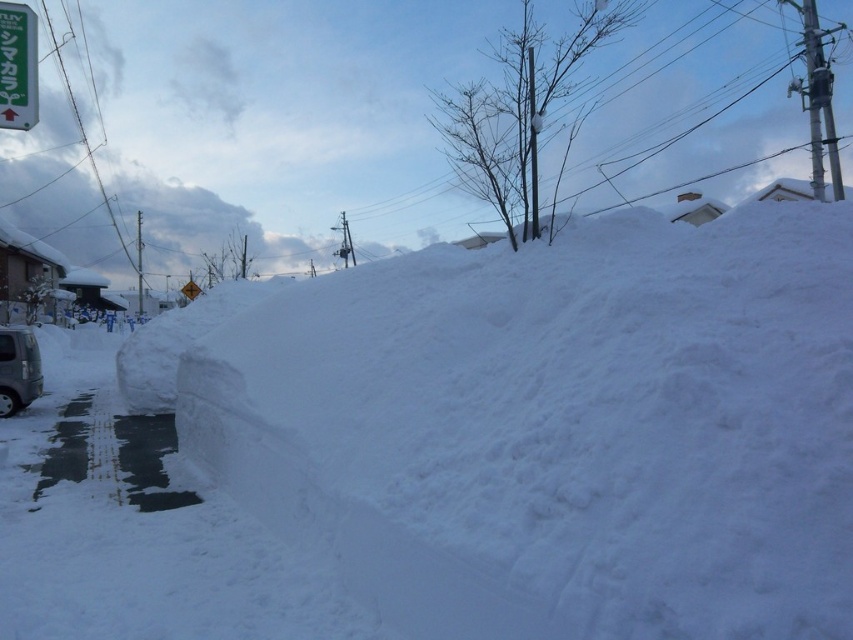
You are standing at the point labeled point (9, 20) and want to walk to point (703, 262). Given the snowy terrain described, will you have to climb over the snowbank in your path?

Point (703, 262) is in front of point (9, 20), so you would not need to climb over the snowbank to reach it as it is in the direction of your path.

You are a delivery person trying to navigate through the snowy street. You see a green plastic sign at upper left and a metallic silver car at lower left. Which object is closer to you as you approach the scene?

The green plastic sign at upper left is closer to the viewer than the metallic silver car at lower left, so the green plastic sign at upper left would be closer as you approach the scene.